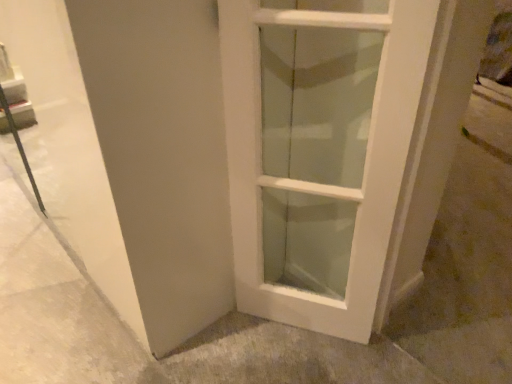
This screenshot has height=384, width=512. I want to click on vacant space to the left of white matte door at center, so click(x=237, y=340).